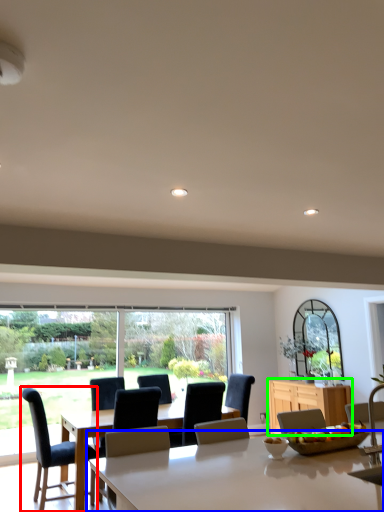
Question: Which is nearer to the chair (highlighted by a red box)? table (highlighted by a blue box) or cabinetry (highlighted by a green box).

Choices:
 (A) table
 (B) cabinetry

Answer: (B)